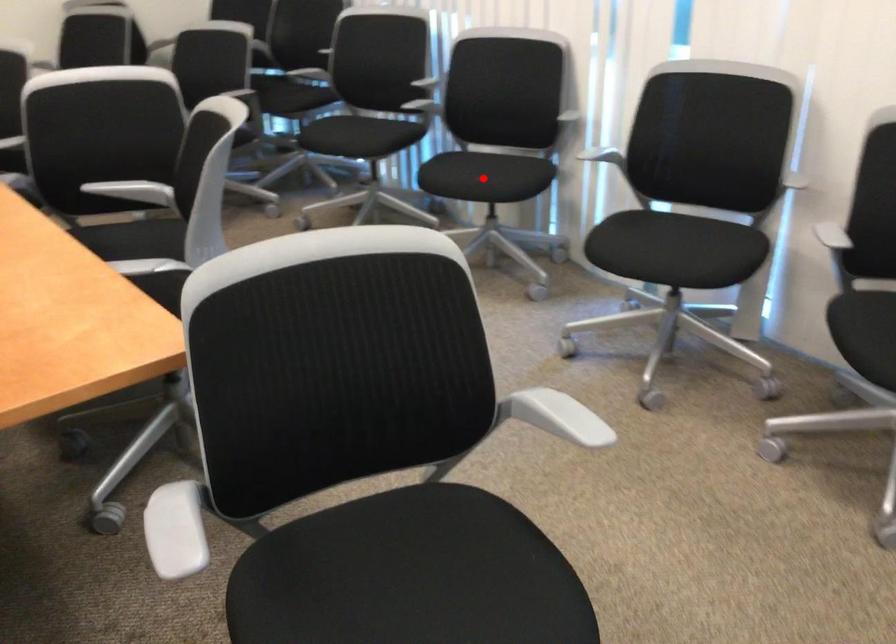
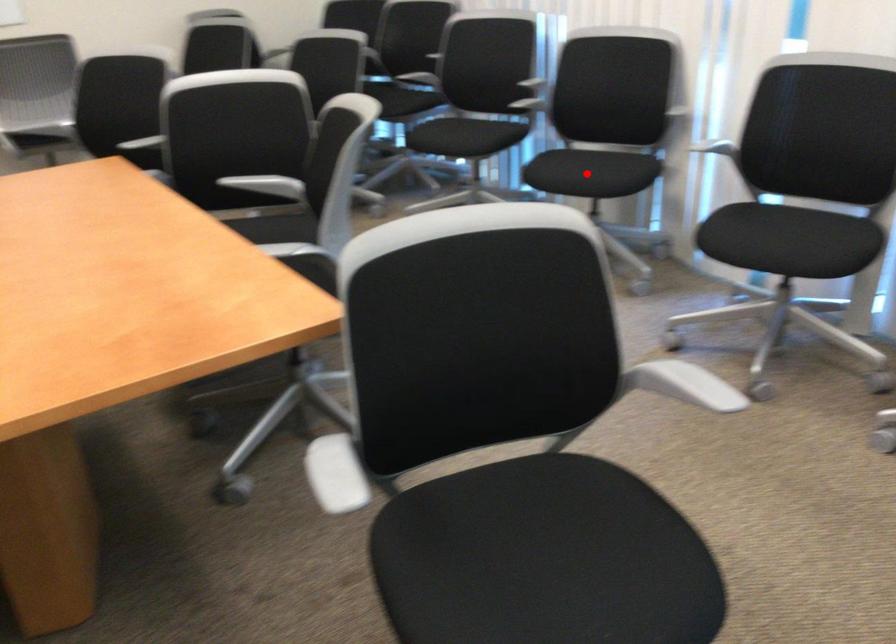
I am providing you with two images of the same scene from different viewpoints. A red point is marked on the first image and another point is marked on the second image. Is the red point in image1 aligned with the point shown in image2?

Yes